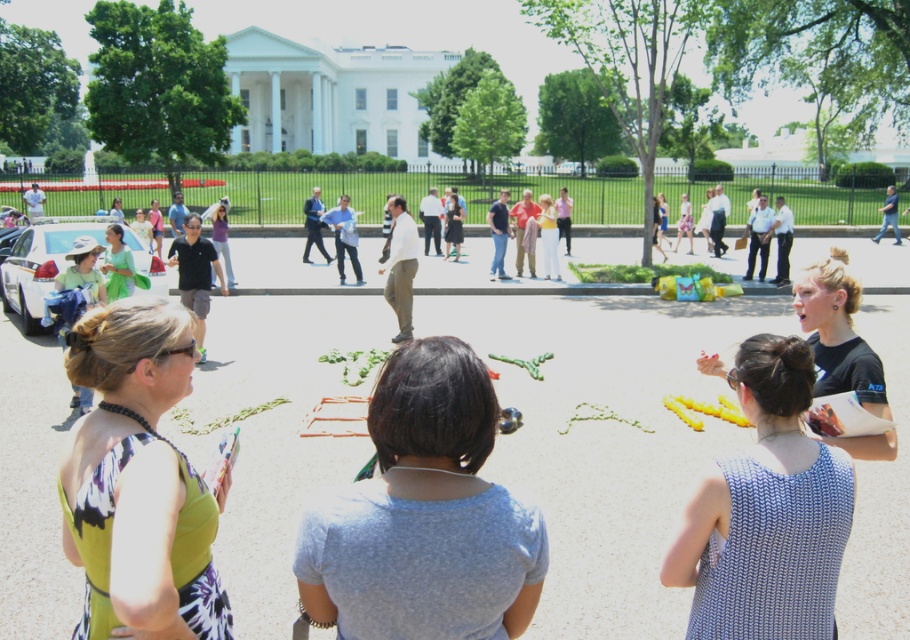
You are a photographer trying to capture a group photo of the people at the event. You want to ensure everyone is in the frame. If your camera has a maximum focus range of 30 inches, will the gray matte shirt at center and the white knitted tank top at center be in focus at the same time?

The distance between the gray matte shirt at center and the white knitted tank top at center is 34.18 inches. Since this exceeds the camera maximum focus range of 30 inches, they cannot be in focus simultaneously.

You are a photographer at the event and want to capture a photo that includes both the gray matte shirt at center and the matte green dress at center. Which object should you focus on first to ensure both are in the frame?

You should focus on the matte green dress at center first because the gray matte shirt at center is positioned under it, so adjusting the camera to include the dress will naturally include the shirt as well.